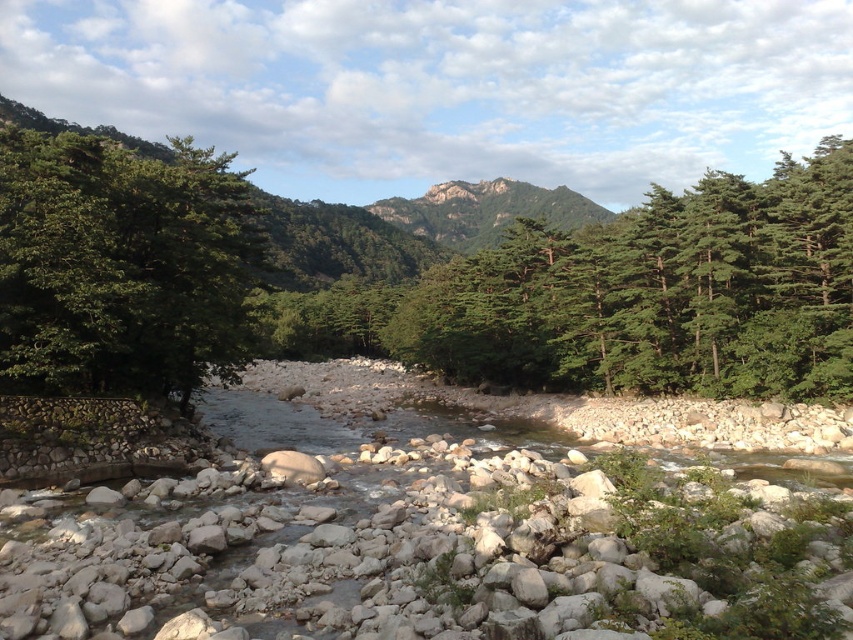
Image resolution: width=853 pixels, height=640 pixels. Describe the element at coordinates (625, 296) in the screenshot. I see `green textured trees at center` at that location.

How much distance is there between green textured trees at center and green leafy tree at left?

The distance of green textured trees at center from green leafy tree at left is 35.85 meters.

Where is `green textured trees at center`? green textured trees at center is located at coordinates click(x=625, y=296).

Does green leafy tree at left have a greater height compared to rugged stone mountain at center?

In fact, green leafy tree at left may be shorter than rugged stone mountain at center.

Can you confirm if green leafy tree at left is positioned below rugged stone mountain at center?

Indeed, green leafy tree at left is positioned under rugged stone mountain at center.

What do you see at coordinates (122, 266) in the screenshot? Image resolution: width=853 pixels, height=640 pixels. I see `green leafy tree at left` at bounding box center [122, 266].

Where is `green leafy tree at left`? The height and width of the screenshot is (640, 853). green leafy tree at left is located at coordinates (122, 266).

Is point (830, 352) positioned behind point (490, 220)?

That is False.

Does point (442, 316) come closer to viewer compared to point (514, 205)?

Yes, it is in front of point (514, 205).

Where is `green textured trees at center`? green textured trees at center is located at coordinates (625, 296).